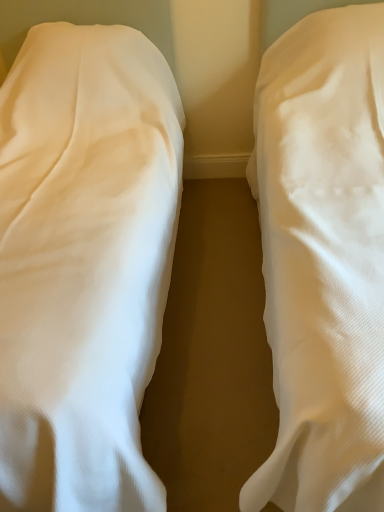
Question: Which direction should I rotate to look at white textured fabric at center, the second bed from the left?

Choices:
 (A) right
 (B) left

Answer: (A)

Question: Does white textured fabric at center, which appears as the first bed when viewed from the right, have a greater height compared to white fabric bed at left, which appears as the second bed when viewed from the right?

Choices:
 (A) yes
 (B) no

Answer: (B)

Question: Is white textured fabric at center, which appears as the first bed when viewed from the right, completely or partially outside of white fabric bed at left, which appears as the second bed when viewed from the right?

Choices:
 (A) no
 (B) yes

Answer: (B)

Question: From the image's perspective, is white textured fabric at center, which appears as the first bed when viewed from the right, on top of white fabric bed at left, which appears as the second bed when viewed from the right?

Choices:
 (A) yes
 (B) no

Answer: (A)

Question: Is white textured fabric at center, which appears as the first bed when viewed from the right, far away from white fabric bed at left, which appears as the second bed when viewed from the right?

Choices:
 (A) no
 (B) yes

Answer: (A)

Question: Considering the relative sizes of white textured fabric at center, which appears as the first bed when viewed from the right, and white fabric bed at left, acting as the 1th bed starting from the left, in the image provided, is white textured fabric at center, which appears as the first bed when viewed from the right, smaller than white fabric bed at left, acting as the 1th bed starting from the left,?

Choices:
 (A) yes
 (B) no

Answer: (A)

Question: From the image's perspective, is white textured fabric at center, the second bed from the left, located beneath white fabric bed at left, which appears as the second bed when viewed from the right?

Choices:
 (A) yes
 (B) no

Answer: (B)

Question: Is white fabric bed at left, which appears as the second bed when viewed from the right, positioned behind white textured fabric at center, the second bed from the left?

Choices:
 (A) yes
 (B) no

Answer: (A)

Question: Does white fabric bed at left, acting as the 1th bed starting from the left, have a lesser width compared to white textured fabric at center, which appears as the first bed when viewed from the right?

Choices:
 (A) yes
 (B) no

Answer: (B)

Question: Considering the relative sizes of white fabric bed at left, which appears as the second bed when viewed from the right, and white textured fabric at center, which appears as the first bed when viewed from the right, in the image provided, is white fabric bed at left, which appears as the second bed when viewed from the right, taller than white textured fabric at center, which appears as the first bed when viewed from the right,?

Choices:
 (A) yes
 (B) no

Answer: (A)

Question: From the image's perspective, does white fabric bed at left, acting as the 1th bed starting from the left, appear higher than white textured fabric at center, the second bed from the left?

Choices:
 (A) no
 (B) yes

Answer: (A)

Question: Are white fabric bed at left, which appears as the second bed when viewed from the right, and white textured fabric at center, which appears as the first bed when viewed from the right, beside each other?

Choices:
 (A) no
 (B) yes

Answer: (A)

Question: Is white fabric bed at left, acting as the 1th bed starting from the left, at the left side of white textured fabric at center, the second bed from the left?

Choices:
 (A) yes
 (B) no

Answer: (A)

Question: From their relative heights in the image, would you say white textured fabric at center, the second bed from the left, is taller or shorter than white fabric bed at left, acting as the 1th bed starting from the left?

Choices:
 (A) short
 (B) tall

Answer: (A)